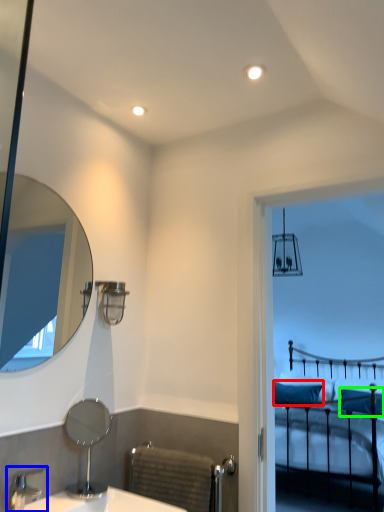
Question: Considering the real-world distances, which object is farthest from pillow (highlighted by a red box)? tap (highlighted by a blue box) or pillow (highlighted by a green box)?

Choices:
 (A) tap
 (B) pillow

Answer: (A)